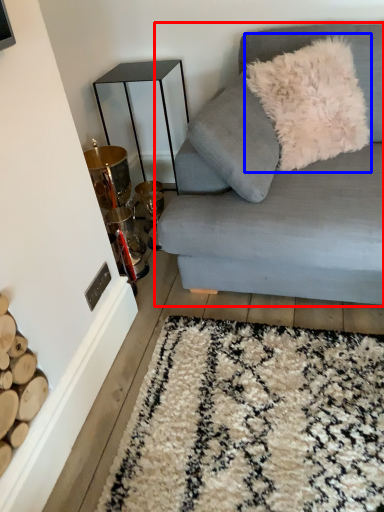
Question: Which of the following is the closest to the observer, studio couch (highlighted by a red box) or throw pillow (highlighted by a blue box)?

Choices:
 (A) studio couch
 (B) throw pillow

Answer: (A)